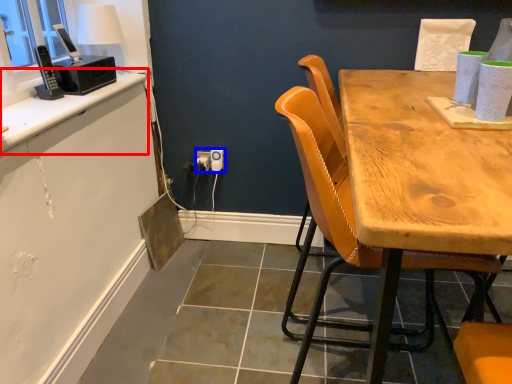
Question: Among these objects, which one is farthest to the camera, counter top (highlighted by a red box) or electric outlet (highlighted by a blue box)?

Choices:
 (A) counter top
 (B) electric outlet

Answer: (B)